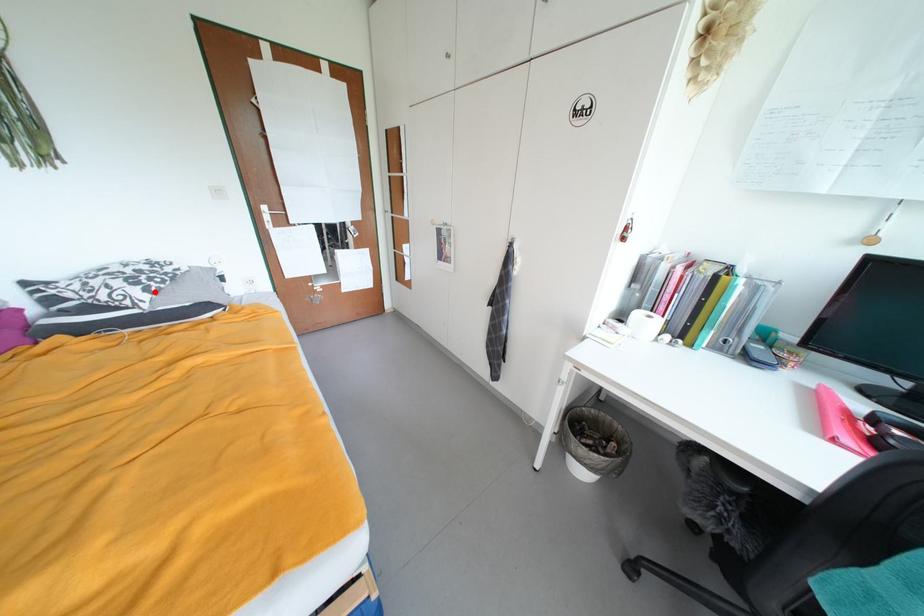
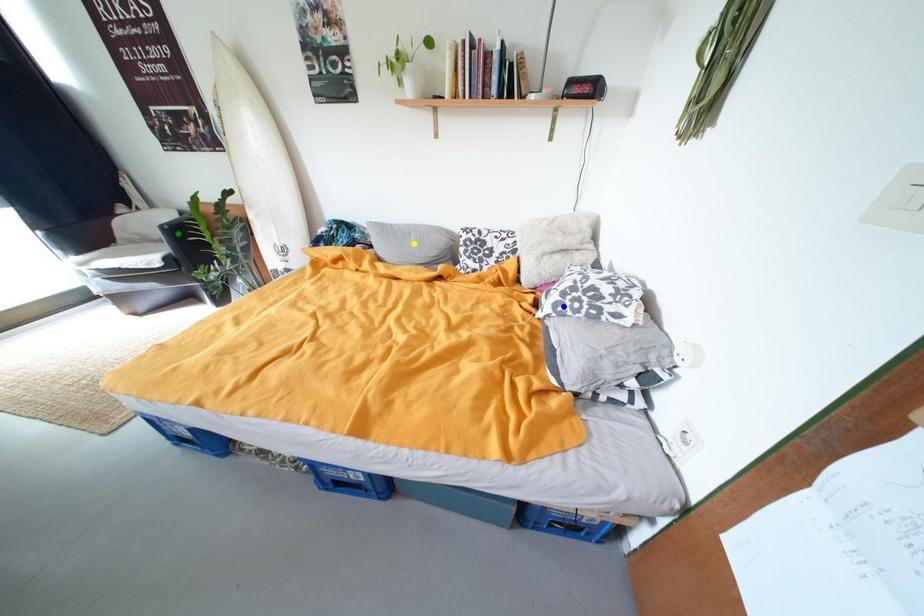
Question: I am providing you with two images of the same scene from different viewpoints. A red point is marked on the first image. You are given multiple points on the second image. Which mark in image 2 goes with the point in image 1?

Choices:
 (A) green point
 (B) yellow point
 (C) blue point

Answer: (C)